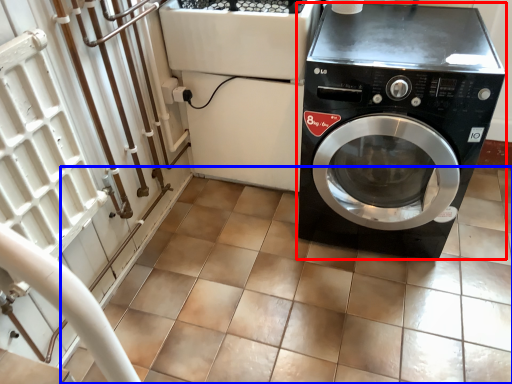
Question: Which object appears farthest to the camera in this image, washing machine (highlighted by a red box) or tile (highlighted by a blue box)?

Choices:
 (A) washing machine
 (B) tile

Answer: (A)